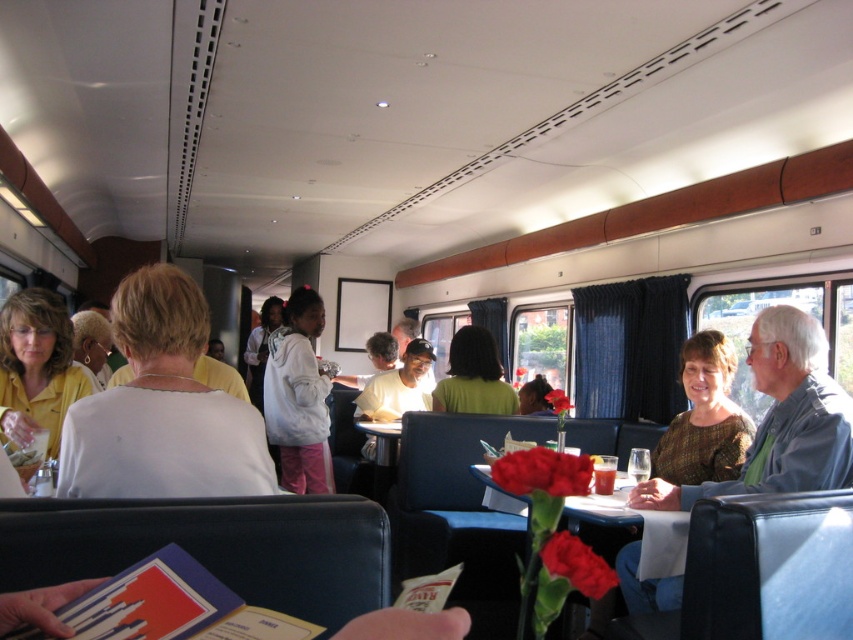
Looking at this image, you are a passenger sitting in the train dining car and notice a white matte shirt at center and a matte black table at center. Which object is positioned to the left side from your perspective?

The white matte shirt at center is to the left of the matte black table at center from your perspective.

You are a passenger on the train and want to place your white fleece jacket at center on the table. The table is located at point 0.5,0.5. Can you place the jacket on the table?

The white fleece jacket at center is located at point (x=299, y=396), which is further away from the table at (x=426, y=320) compared to other possible locations. Therefore, you can place the jacket on the table.

You are a server in the train dining car and need to place a 5.5 feet long tray from the white matte shirt at center to the matte black table at center. Can you fit the tray between them without bending it?

The distance between the white matte shirt at center and the matte black table at center is 5.42 feet, which is slightly shorter than the 5.5 feet long tray. Therefore, the tray cannot be placed straight between them without bending.